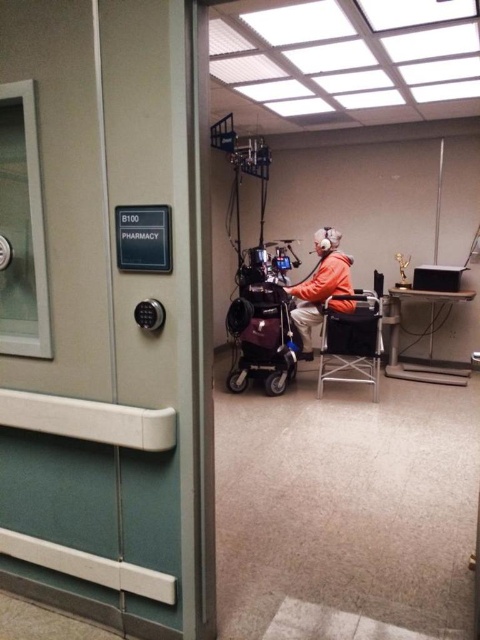
Question: Is metallic folding chair at center further to the viewer compared to orange fleece jacket at center?

Choices:
 (A) yes
 (B) no

Answer: (B)

Question: Which point appears farthest from the camera in this image?

Choices:
 (A) (315, 304)
 (B) (324, 344)

Answer: (A)

Question: Among these objects, which one is nearest to the camera?

Choices:
 (A) orange fleece jacket at center
 (B) metallic folding chair at center

Answer: (B)

Question: From the image, what is the correct spatial relationship of metallic folding chair at center in relation to orange fleece jacket at center?

Choices:
 (A) above
 (B) below

Answer: (B)

Question: Can you confirm if metallic folding chair at center is bigger than orange fleece jacket at center?

Choices:
 (A) no
 (B) yes

Answer: (B)

Question: Which of the following is the closest to the observer?

Choices:
 (A) metallic folding chair at center
 (B) orange fleece jacket at center

Answer: (A)